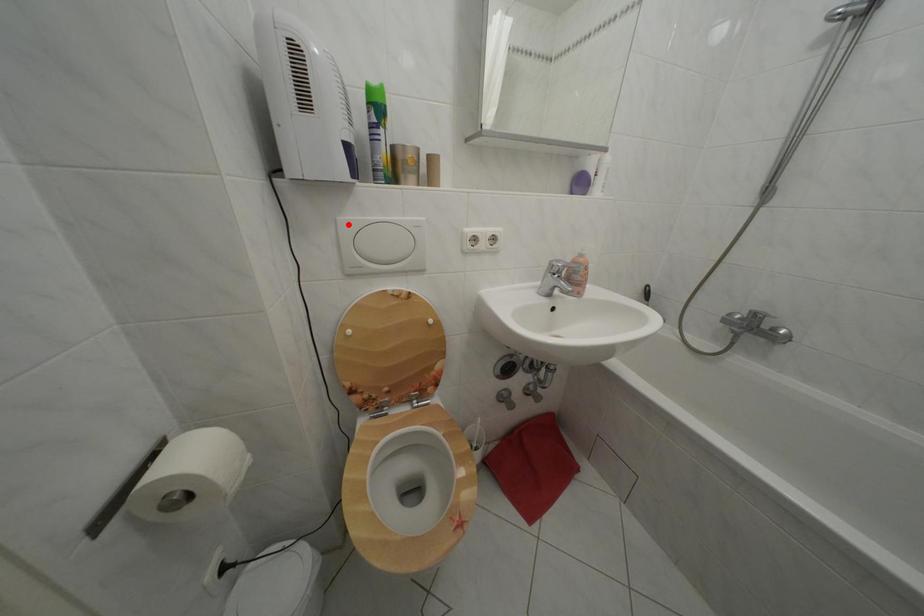
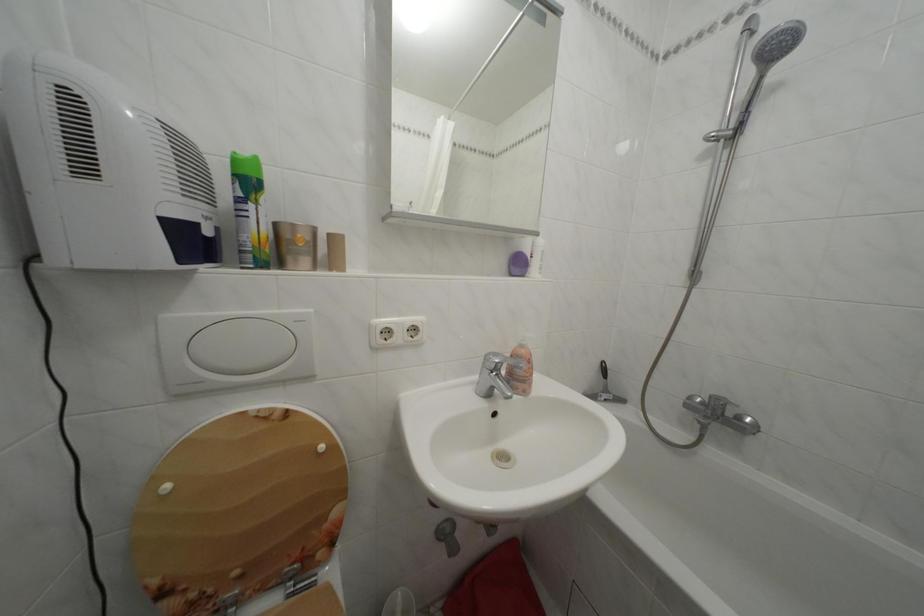
The point at the highlighted location is marked in the first image. Where is the corresponding point in the second image?

(174, 323)